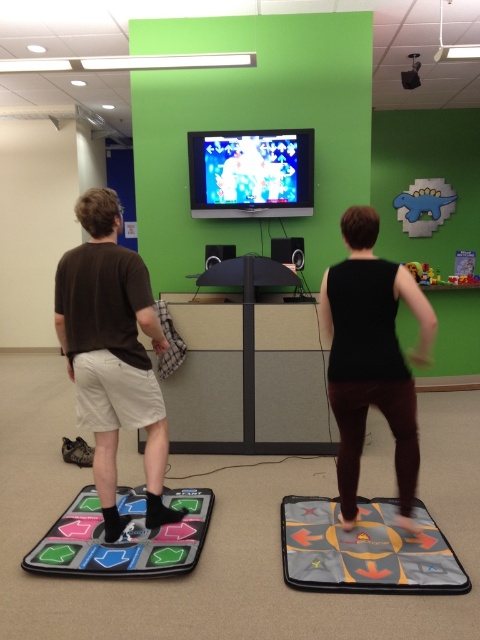
You are a photographer standing in the room. You want to take a photo of the black matte tank top at center and the shiny plastic tv at upper center. Which object will appear larger in the photo?

The black matte tank top at center will appear larger in the photo because it is closer to the viewer than the shiny plastic tv at upper center.

You are a dancer standing at the center of the room. You need to step onto the rubberized plastic dance pad at lower left represented by point (123, 538). Which direction should you move from your current position to reach it?

The rubberized plastic dance pad at lower left is located at point (123, 538). Since you are at the center, you should move towards the lower left direction to reach it.

You are a delivery person who needs to place a large package in the room where the rubberized plastic dance pad at lower left and the shiny plastic tv at upper center are located. Based on their sizes, which object should you avoid placing the package near to ensure there is enough space?

You should avoid placing the package near the rubberized plastic dance pad at lower left because it occupies less space than the shiny plastic tv at upper center, so there is less room around it for the package.